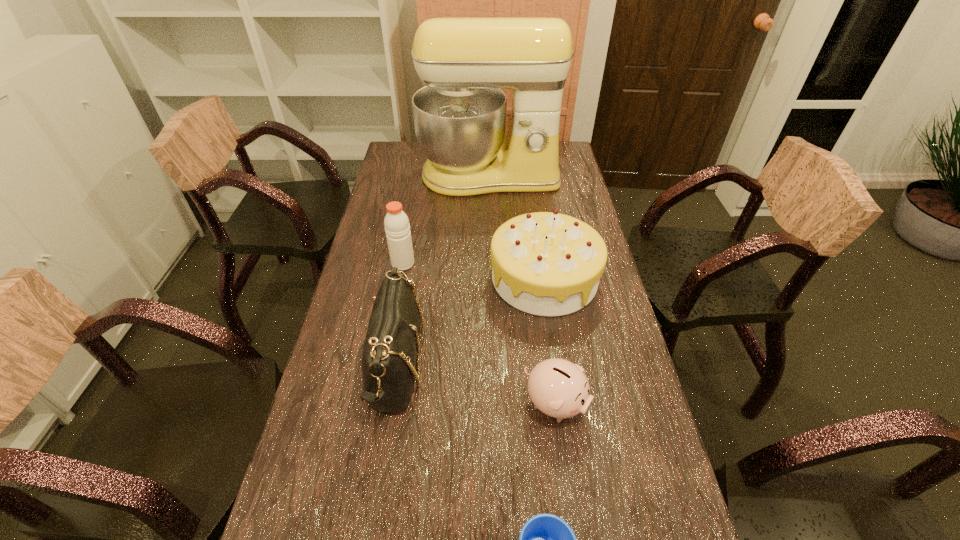
Where is `vacant space at the left edge of the desktop`? Image resolution: width=960 pixels, height=540 pixels. vacant space at the left edge of the desktop is located at coordinates (412, 185).

Where is `free space at the right edge of the desktop`? The image size is (960, 540). free space at the right edge of the desktop is located at coordinates (660, 458).

Locate an element on the screen. This screenshot has height=540, width=960. unoccupied position between the piggy bank and the birthday cake is located at coordinates (550, 341).

The image size is (960, 540). Find the location of `free space between the handbag and the birthday cake`. free space between the handbag and the birthday cake is located at coordinates (469, 321).

The width and height of the screenshot is (960, 540). I want to click on unoccupied area between the fifth tallest object and the shaker, so click(x=479, y=333).

Find the location of a particular element. This screenshot has height=540, width=960. the second closest object to the handbag is located at coordinates (549, 264).

Identify the location of object that can be found as the closest to the shaker. (390, 350).

Find the location of `free space that satisfies the following two spatial constraints: 1. on the side of the farthest object with the control knob; 2. at the front of the handbag with chain and zipper`. free space that satisfies the following two spatial constraints: 1. on the side of the farthest object with the control knob; 2. at the front of the handbag with chain and zipper is located at coordinates (495, 364).

This screenshot has height=540, width=960. What are the coordinates of `vacant region that satisfies the following two spatial constraints: 1. on the side of the mixer with the control knob; 2. at the front of the handbag with chain and zipper` in the screenshot? It's located at (495, 364).